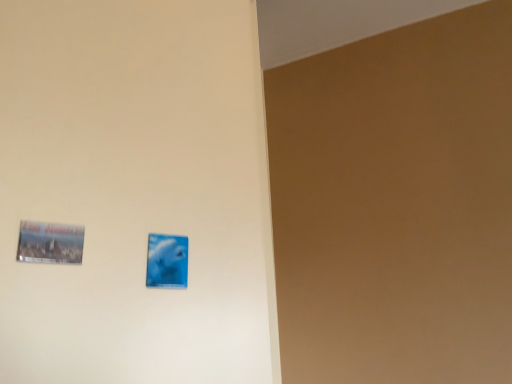
Question: Is the position of metallic silver picture frame at lower left, arranged as the second picture frame when viewed from the back, less distant than that of blue glossy picture frame at center, arranged as the 1th picture frame when viewed from the right?

Choices:
 (A) yes
 (B) no

Answer: (A)

Question: Considering the relative sizes of metallic silver picture frame at lower left, arranged as the second picture frame when viewed from the back, and blue glossy picture frame at center, the first picture frame when ordered from back to front, in the image provided, is metallic silver picture frame at lower left, arranged as the second picture frame when viewed from the back, shorter than blue glossy picture frame at center, the first picture frame when ordered from back to front,?

Choices:
 (A) no
 (B) yes

Answer: (B)

Question: Does metallic silver picture frame at lower left, arranged as the second picture frame when viewed from the back, have a lesser width compared to blue glossy picture frame at center, acting as the second picture frame starting from the left?

Choices:
 (A) no
 (B) yes

Answer: (A)

Question: Is blue glossy picture frame at center, arranged as the 1th picture frame when viewed from the right, a part of metallic silver picture frame at lower left, marked as the first picture frame in a left-to-right arrangement?

Choices:
 (A) no
 (B) yes

Answer: (A)

Question: Can you confirm if metallic silver picture frame at lower left, which is counted as the second picture frame, starting from the right, is taller than blue glossy picture frame at center, the second picture frame from the front?

Choices:
 (A) yes
 (B) no

Answer: (B)

Question: Does metallic silver picture frame at lower left, arranged as the second picture frame when viewed from the back, have a greater width compared to blue glossy picture frame at center, arranged as the 1th picture frame when viewed from the right?

Choices:
 (A) yes
 (B) no

Answer: (A)

Question: Is metallic silver picture frame at lower left, marked as the first picture frame in a left-to-right arrangement, completely or partially inside blue glossy picture frame at center, the first picture frame when ordered from back to front?

Choices:
 (A) no
 (B) yes

Answer: (A)

Question: From the image's perspective, is blue glossy picture frame at center, arranged as the 1th picture frame when viewed from the right, located above metallic silver picture frame at lower left, marked as the first picture frame in a left-to-right arrangement?

Choices:
 (A) no
 (B) yes

Answer: (A)

Question: Is blue glossy picture frame at center, the first picture frame when ordered from back to front, not close to metallic silver picture frame at lower left, arranged as the second picture frame when viewed from the back?

Choices:
 (A) no
 (B) yes

Answer: (A)

Question: Considering the relative positions of blue glossy picture frame at center, acting as the second picture frame starting from the left, and metallic silver picture frame at lower left, which is counted as the second picture frame, starting from the right, in the image provided, is blue glossy picture frame at center, acting as the second picture frame starting from the left, in front of metallic silver picture frame at lower left, which is counted as the second picture frame, starting from the right,?

Choices:
 (A) yes
 (B) no

Answer: (B)

Question: Considering the relative sizes of blue glossy picture frame at center, the first picture frame when ordered from back to front, and metallic silver picture frame at lower left, marked as the first picture frame in a left-to-right arrangement, in the image provided, is blue glossy picture frame at center, the first picture frame when ordered from back to front, shorter than metallic silver picture frame at lower left, marked as the first picture frame in a left-to-right arrangement,?

Choices:
 (A) no
 (B) yes

Answer: (A)

Question: Is blue glossy picture frame at center, acting as the second picture frame starting from the left, next to metallic silver picture frame at lower left, arranged as the second picture frame when viewed from the back, and touching it?

Choices:
 (A) yes
 (B) no

Answer: (B)

Question: Is metallic silver picture frame at lower left, arranged as the second picture frame when viewed from the back, taller or shorter than blue glossy picture frame at center, the second picture frame from the front?

Choices:
 (A) tall
 (B) short

Answer: (B)